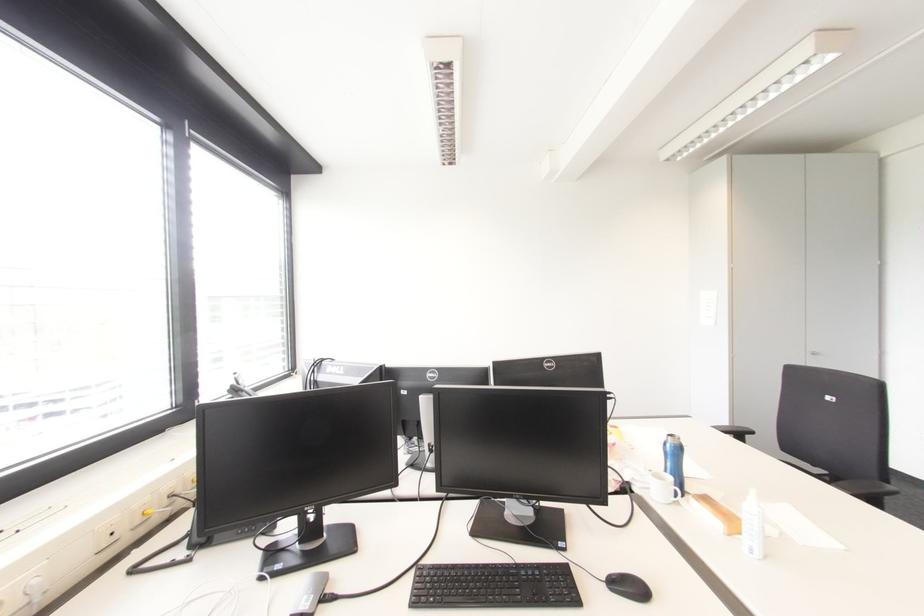
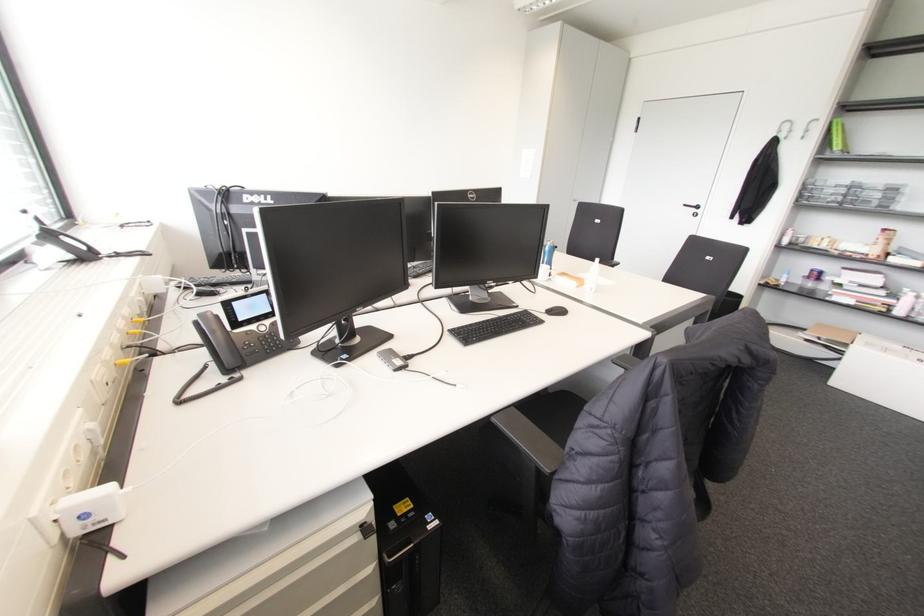
In the second image, find the point that corresponds to [667,445] in the first image.

(546, 246)